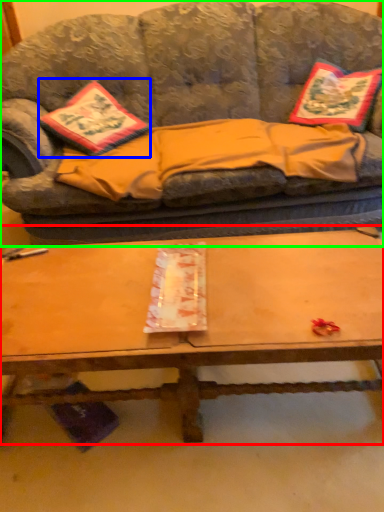
Question: Estimate the real-world distances between objects in this image. Which object is farther from coffee table (highlighted by a red box), throw pillow (highlighted by a blue box) or studio couch (highlighted by a green box)?

Choices:
 (A) throw pillow
 (B) studio couch

Answer: (A)